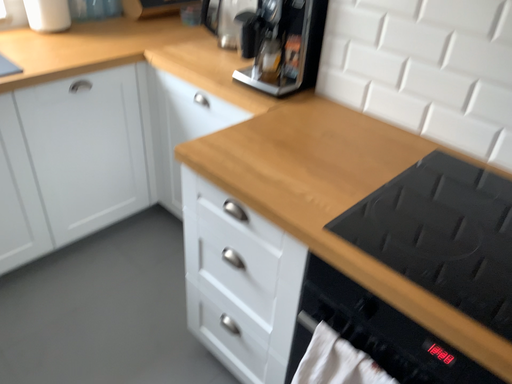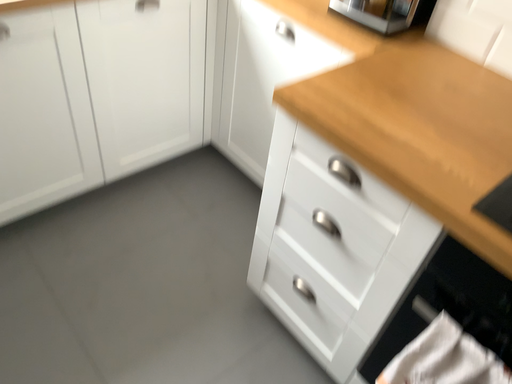
Question: How did the camera likely rotate when shooting the video?

Choices:
 (A) rotated downward
 (B) rotated upward

Answer: (A)